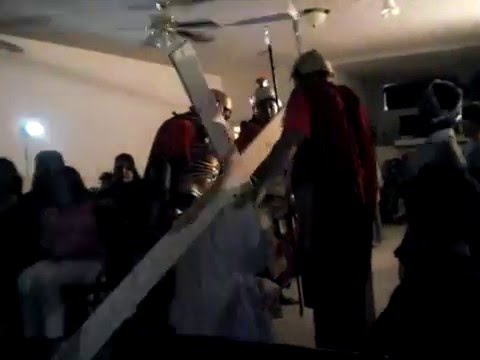
You are a GUI agent. You are given a task and a screenshot of the screen. Output one action in this format:
    pyautogui.click(x=<x>, y=<y>)
    Task: Click on the light
    The image size is (480, 360).
    Given the screenshot: What is the action you would take?
    pyautogui.click(x=314, y=7)